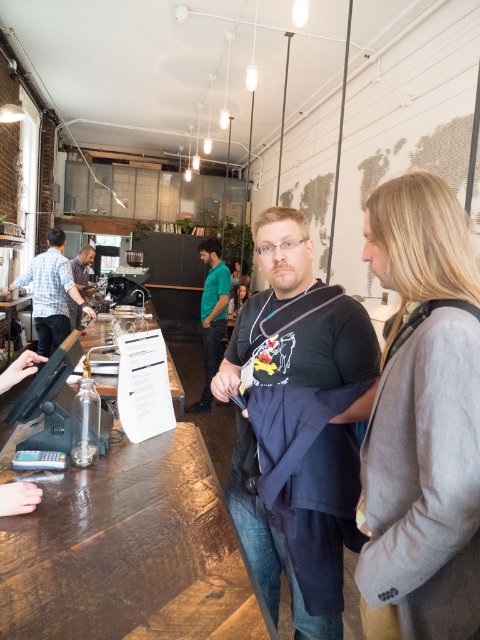
Question: Which is farther from the green fabric shirt at center?

Choices:
 (A) matte black shirt at center
 (B) gray wool coat at center

Answer: (B)

Question: From the image, what is the correct spatial relationship of black matte t-shirt at center in relation to green fabric shirt at center?

Choices:
 (A) left
 (B) right

Answer: (B)

Question: Does black matte t-shirt at center have a larger size compared to green fabric shirt at center?

Choices:
 (A) no
 (B) yes

Answer: (A)

Question: Does black matte t-shirt at center have a smaller size compared to plaid shirt at left?

Choices:
 (A) no
 (B) yes

Answer: (B)

Question: Which object appears closest to the camera in this image?

Choices:
 (A) plaid shirt at left
 (B) black matte t-shirt at center
 (C) gray wool coat at center

Answer: (C)

Question: Based on their relative distances, which object is farther from the matte black shirt at center?

Choices:
 (A) gray wool coat at center
 (B) green fabric shirt at center
 (C) black matte t-shirt at center
 (D) plaid shirt at left

Answer: (A)